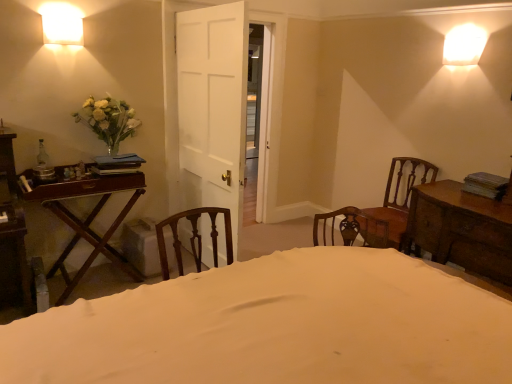
I want to click on free spot above white glossy wall sconce at upper left (from a real-world perspective), so point(59,17).